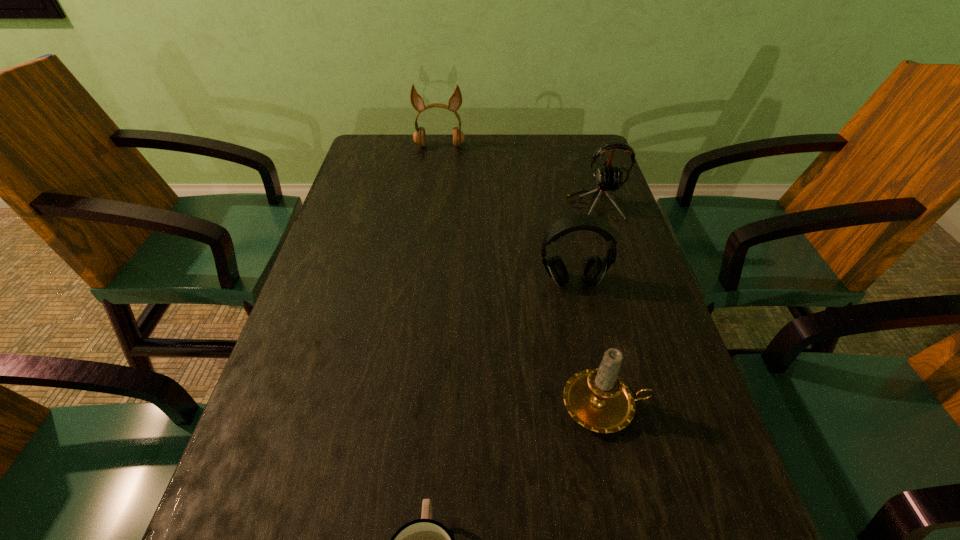
Where is `object identified as the third closest to the fourth nearest object`? The height and width of the screenshot is (540, 960). object identified as the third closest to the fourth nearest object is located at coordinates (597, 399).

The image size is (960, 540). Find the location of `object that is the fourth closest one to the nearest earphone`. object that is the fourth closest one to the nearest earphone is located at coordinates (455, 101).

Locate which earphone is the second closest to the shortest object. Please provide its 2D coordinates. Your answer should be formatted as a tuple, i.e. [(x, y)], where the tuple contains the x and y coordinates of a point satisfying the conditions above.

[(608, 179)]

The width and height of the screenshot is (960, 540). I want to click on the third closest earphone relative to the fourth farthest object, so click(x=455, y=101).